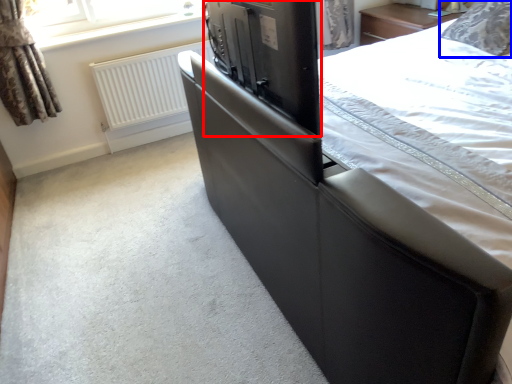
Question: Which point is closer to the camera, appliance (highlighted by a red box) or pillow (highlighted by a blue box)?

Choices:
 (A) appliance
 (B) pillow

Answer: (A)